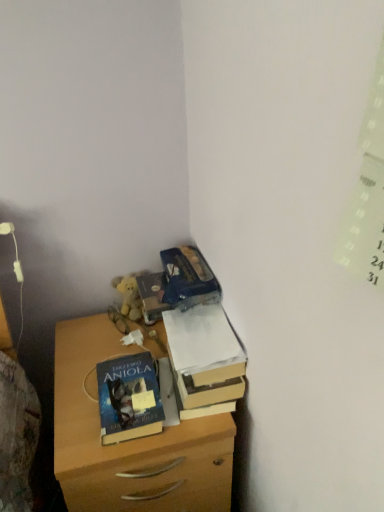
The image size is (384, 512). I want to click on wooden chest of drawers at lower left, so (130, 440).

Identify the location of wooden chest of drawers at lower left. This screenshot has width=384, height=512. (130, 440).

Is point (120, 385) less distant than point (200, 359)?

No, (120, 385) is further to viewer.

From the picture: In the image, is blue matte book at center positioned in front of or behind cardboard box at upper right?

Clearly, blue matte book at center is in front of cardboard box at upper right.

Is cardboard box at upper right completely or partially inside blue matte book at center?

No, cardboard box at upper right is not inside blue matte book at center.

Which point is more forward, (193, 488) or (224, 365)?

The point (224, 365) is closer to the camera.

Looking at this image, which is behind, wooden chest of drawers at lower left or cardboard box at upper right?

Positioned behind is cardboard box at upper right.

Considering the sizes of wooden chest of drawers at lower left and cardboard box at upper right in the image, is wooden chest of drawers at lower left wider or thinner than cardboard box at upper right?

Considering their sizes, wooden chest of drawers at lower left looks broader than cardboard box at upper right.

What's the angular difference between wooden chest of drawers at lower left and cardboard box at upper right's facing directions?

There is a 0.437-degree angle between the facing directions of wooden chest of drawers at lower left and cardboard box at upper right.

What's the angular difference between wooden chest of drawers at lower left and blue matte book at center's facing directions?

The angle between the facing direction of wooden chest of drawers at lower left and the facing direction of blue matte book at center is 0.15 degrees.

Based on the photo, is wooden chest of drawers at lower left facing towards blue matte book at center?

No, wooden chest of drawers at lower left is not aimed at blue matte book at center.

In the scene shown: Is wooden chest of drawers at lower left at the right side of blue matte book at center?

Correct, you'll find wooden chest of drawers at lower left to the right of blue matte book at center.

Does wooden chest of drawers at lower left touch blue matte book at center?

No, wooden chest of drawers at lower left is not making contact with blue matte book at center.

Consider the image. Considering the sizes of objects cardboard box at upper right and wooden chest of drawers at lower left in the image provided, who is bigger, cardboard box at upper right or wooden chest of drawers at lower left?

With larger size is wooden chest of drawers at lower left.

Is cardboard box at upper right looking in the opposite direction of wooden chest of drawers at lower left?

No, cardboard box at upper right is not facing the opposite direction of wooden chest of drawers at lower left.

Considering the relative sizes of cardboard box at upper right and wooden chest of drawers at lower left in the image provided, is cardboard box at upper right shorter than wooden chest of drawers at lower left?

Correct, cardboard box at upper right is not as tall as wooden chest of drawers at lower left.

Is cardboard box at upper right directly adjacent to wooden chest of drawers at lower left?

No, cardboard box at upper right is not beside wooden chest of drawers at lower left.

Consider the image. From the image's perspective, is blue matte book at center over wooden chest of drawers at lower left?

Yes, from the image's perspective, blue matte book at center is above wooden chest of drawers at lower left.

Is blue matte book at center taller than wooden chest of drawers at lower left?

No, blue matte book at center is not taller than wooden chest of drawers at lower left.

Which object is closer to the camera, blue matte book at center or wooden chest of drawers at lower left?

wooden chest of drawers at lower left is more forward.

How much distance is there between cardboard box at upper right and blue matte book at center?

They are 14.27 centimeters apart.

Considering the sizes of cardboard box at upper right and blue matte book at center in the image, is cardboard box at upper right bigger or smaller than blue matte book at center?

Clearly, cardboard box at upper right is larger in size than blue matte book at center.

Is cardboard box at upper right far from blue matte book at center?

No, cardboard box at upper right is not far away from blue matte book at center.

The image size is (384, 512). I want to click on book in front of the cardboard box at upper right, so click(129, 398).

At what (x,y) coordinates should I click in order to perform the action: click on chest of drawers that is on the left side of cardboard box at upper right. Please return your answer as a coordinate pair (x, y). Image resolution: width=384 pixels, height=512 pixels. Looking at the image, I should click on (130, 440).

From the picture: Considering their positions, is wooden chest of drawers at lower left positioned further to cardboard box at upper right than blue matte book at center?

Among the two, wooden chest of drawers at lower left is located further to cardboard box at upper right.

Considering their positions, is cardboard box at upper right positioned further to wooden chest of drawers at lower left than blue matte book at center?

Based on the image, cardboard box at upper right appears to be further to wooden chest of drawers at lower left.

Which object lies nearer to the anchor point blue matte book at center, wooden chest of drawers at lower left or cardboard box at upper right?

Among the two, wooden chest of drawers at lower left is located nearer to blue matte book at center.

Based on their spatial positions, is cardboard box at upper right or wooden chest of drawers at lower left further from blue matte book at center?

cardboard box at upper right is further to blue matte book at center.

From the image, which object appears to be nearer to wooden chest of drawers at lower left, blue matte book at center or cardboard box at upper right?

Among the two, blue matte book at center is located nearer to wooden chest of drawers at lower left.

Looking at the image, which one is located further to cardboard box at upper right, blue matte book at center or wooden chest of drawers at lower left?

The object further to cardboard box at upper right is wooden chest of drawers at lower left.

The image size is (384, 512). I want to click on book between cardboard box at upper right and wooden chest of drawers at lower left vertically, so click(129, 398).